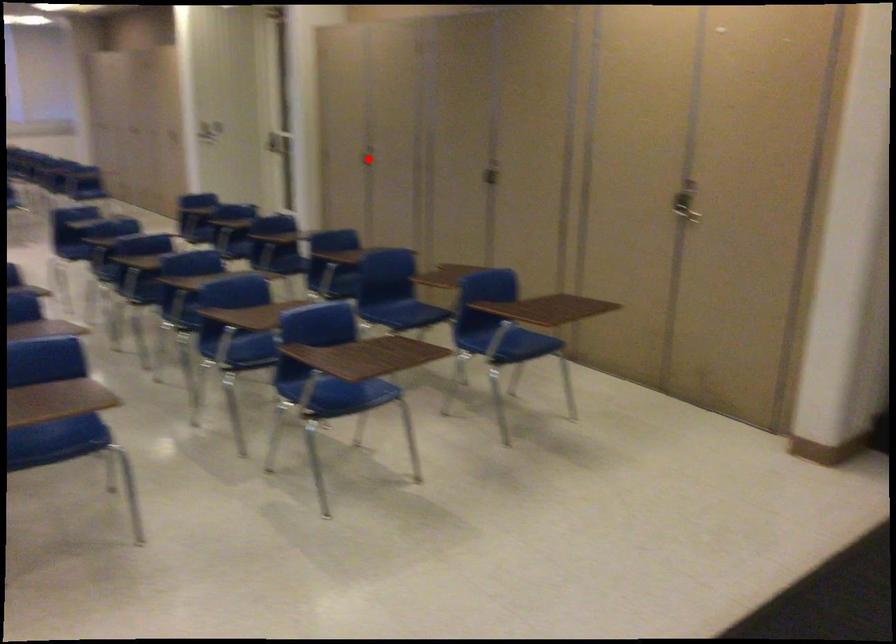
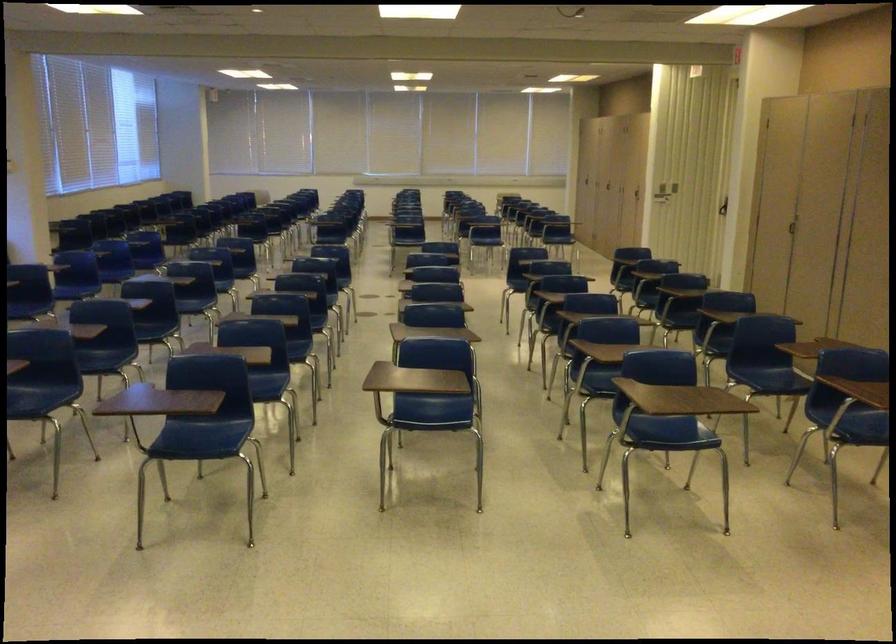
The point at the highlighted location is marked in the first image. Where is the corresponding point in the second image?

(794, 228)